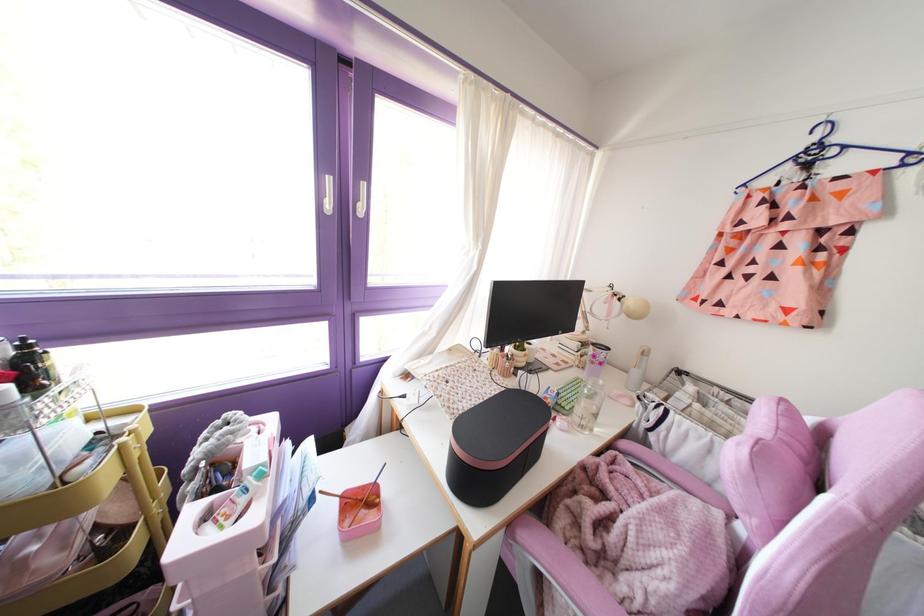
What do you see at coordinates (673, 474) in the screenshot? I see `the pink chair armrest` at bounding box center [673, 474].